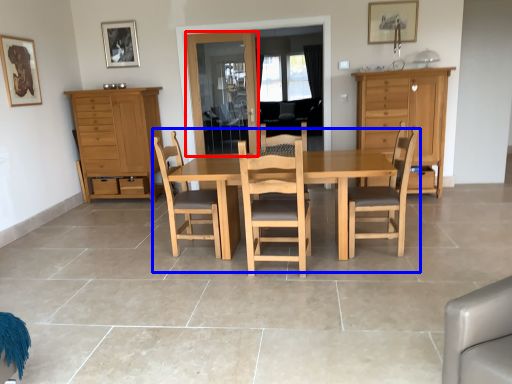
Question: Which point is closer to the camera, glass door (highlighted by a red box) or kitchen & dining room table (highlighted by a blue box)?

Choices:
 (A) glass door
 (B) kitchen & dining room table

Answer: (B)